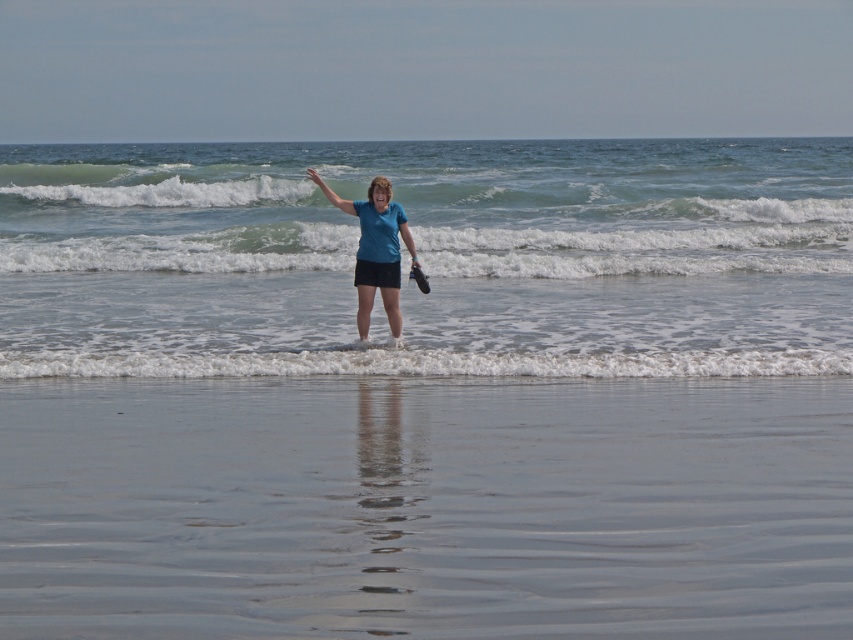
Question: Which point appears farthest from the camera in this image?

Choices:
 (A) (175, 276)
 (B) (405, 228)
 (C) (347, 209)

Answer: (A)

Question: Does blue matte shirt at center have a larger size compared to blue fabric arm at center?

Choices:
 (A) yes
 (B) no

Answer: (A)

Question: Does clear water at center appear on the left side of blue matte shirt at center?

Choices:
 (A) no
 (B) yes

Answer: (B)

Question: Which of the following is the closest to the observer?

Choices:
 (A) smooth sand at lower center
 (B) blue matte shirt at center
 (C) smooth skin hand at center

Answer: (A)

Question: Which of the following is the closest to the observer?

Choices:
 (A) (512, 211)
 (B) (775, 220)

Answer: (B)

Question: Can you confirm if blue matte shirt at center is wider than blue fabric arm at center?

Choices:
 (A) no
 (B) yes

Answer: (B)